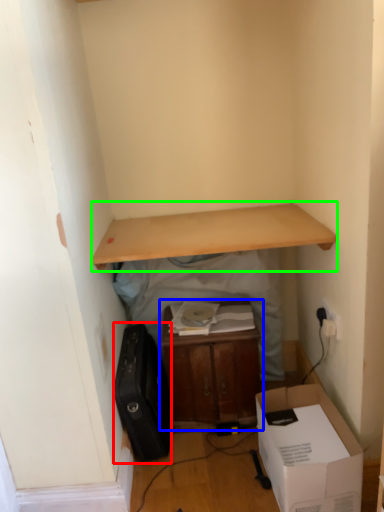
Question: Which object is positioned farthest from luggage (highlighted by a red box)? Select from table (highlighted by a blue box) and desk (highlighted by a green box).

Choices:
 (A) table
 (B) desk

Answer: (B)